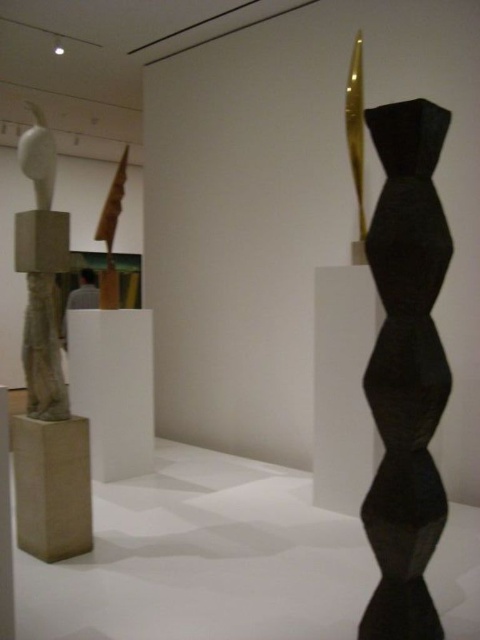
Based on the scene description, where is the black matte hexagonal stack at right located in the image?

The black matte hexagonal stack at right is located at point 0.555 on the x axis and 0.840 on the y axis.

You are standing in the art gallery and want to get a closer look at the sculpture located at point [427,445]. If you move forward 1.5 meters, will you be able to reach it?

The point [427,445] is 2.01 meters away from the viewer. Moving forward 1.5 meters would bring you to 0.51 meters away, so yes, you will be able to reach it.